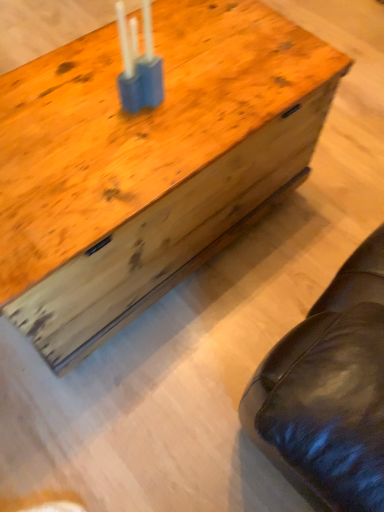
Question: Is blue plastic candle holder at center bigger or smaller than wooden trunk at center?

Choices:
 (A) big
 (B) small

Answer: (B)

Question: Is blue plastic candle holder at center taller or shorter than wooden trunk at center?

Choices:
 (A) short
 (B) tall

Answer: (A)

Question: Do you think blue plastic candle holder at center is within wooden trunk at center, or outside of it?

Choices:
 (A) outside
 (B) inside

Answer: (A)

Question: From the image's perspective, is wooden trunk at center located above or below blue plastic candle holder at center?

Choices:
 (A) below
 (B) above

Answer: (A)

Question: Is point (102, 271) positioned closer to the camera than point (135, 55)?

Choices:
 (A) farther
 (B) closer

Answer: (A)

Question: Is wooden trunk at center inside the boundaries of blue plastic candle holder at center, or outside?

Choices:
 (A) outside
 (B) inside

Answer: (A)

Question: Considering the positions of wooden trunk at center and blue plastic candle holder at center in the image, is wooden trunk at center taller or shorter than blue plastic candle holder at center?

Choices:
 (A) short
 (B) tall

Answer: (B)